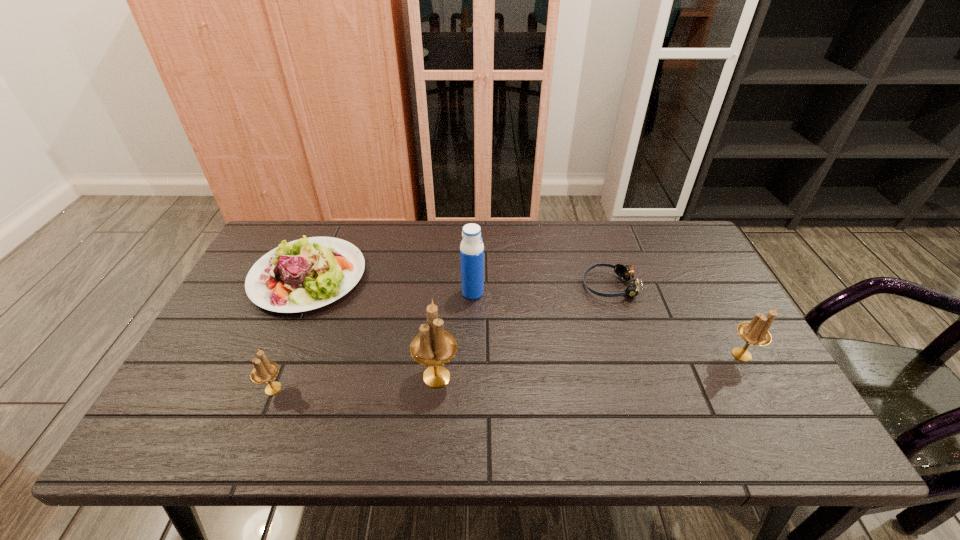
You are a GUI agent. You are given a task and a screenshot of the screen. Output one action in this format:
    pyautogui.click(x=<x>, y=<y>)
    Task: Click on the vacant space located 0.100m on the right of the tallest candle holder
    The image size is (960, 540).
    Given the screenshot: What is the action you would take?
    pyautogui.click(x=501, y=377)

Where is `free space located on the front of the rightmost candle holder`? The height and width of the screenshot is (540, 960). free space located on the front of the rightmost candle holder is located at coordinates (758, 384).

Where is `free spot located on the right of the salad plate`? This screenshot has height=540, width=960. free spot located on the right of the salad plate is located at coordinates (432, 276).

Locate an element on the screen. vacant space located 0.100m on the front of the water bottle is located at coordinates (472, 327).

The width and height of the screenshot is (960, 540). What are the coordinates of `free space located 0.180m through the lenses of the shortest object` in the screenshot? It's located at (521, 286).

Find the location of a particular element. vacant region located through the lenses of the shortest object is located at coordinates (459, 286).

At what (x,y) coordinates should I click in order to perform the action: click on free space located 0.370m through the lenses of the shortest object. Please return your answer as a coordinate pair (x, y). This screenshot has height=540, width=960. Looking at the image, I should click on (456, 286).

You are a GUI agent. You are given a task and a screenshot of the screen. Output one action in this format:
    pyautogui.click(x=<x>, y=<y>)
    Task: Click on the object positioned at the far edge
    The width and height of the screenshot is (960, 540).
    Given the screenshot: What is the action you would take?
    pyautogui.click(x=305, y=274)

This screenshot has width=960, height=540. I want to click on object that is at the left edge, so click(305, 274).

Locate an element on the screen. object that is at the right edge is located at coordinates (755, 332).